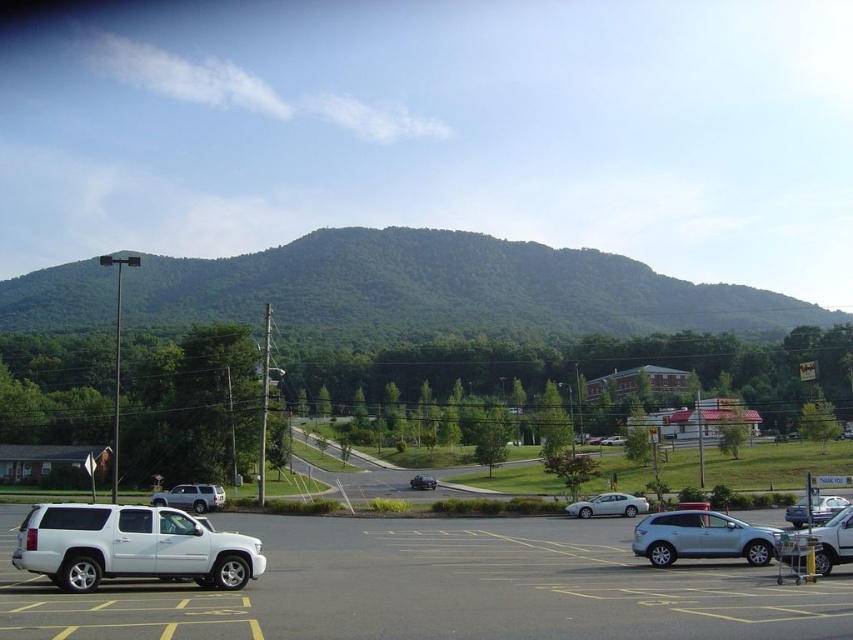
You are a delivery driver who needs to park your truck, which is 1.8 meters tall, in the parking lot. You see the white matte suv at left and the satin silver sedan at center. Which vehicle takes up more vertical space in the parking lot?

The white matte suv at left is much taller than the satin silver sedan at center, so it takes up more vertical space in the parking lot.

You are standing at point [665,602] in the parking lot. You want to walk to the entrance of the mountain trailhead, which is located at the base of the mountain. Is the entrance closer to you or to the white SUV on the left?

The entrance to the mountain trailhead is closer to the white SUV on the left than to you at point [665,602].